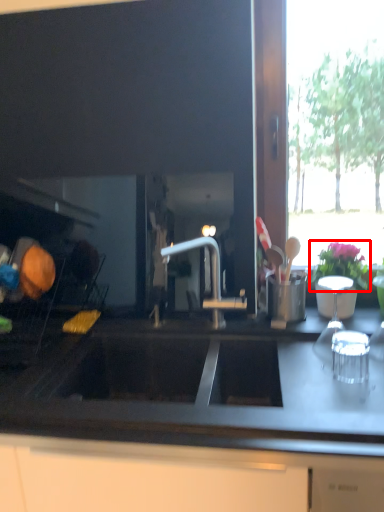
Question: From the image, what is the correct spatial relationship of flower (annotated by the red box) in relation to countertop?

Choices:
 (A) right
 (B) left

Answer: (A)